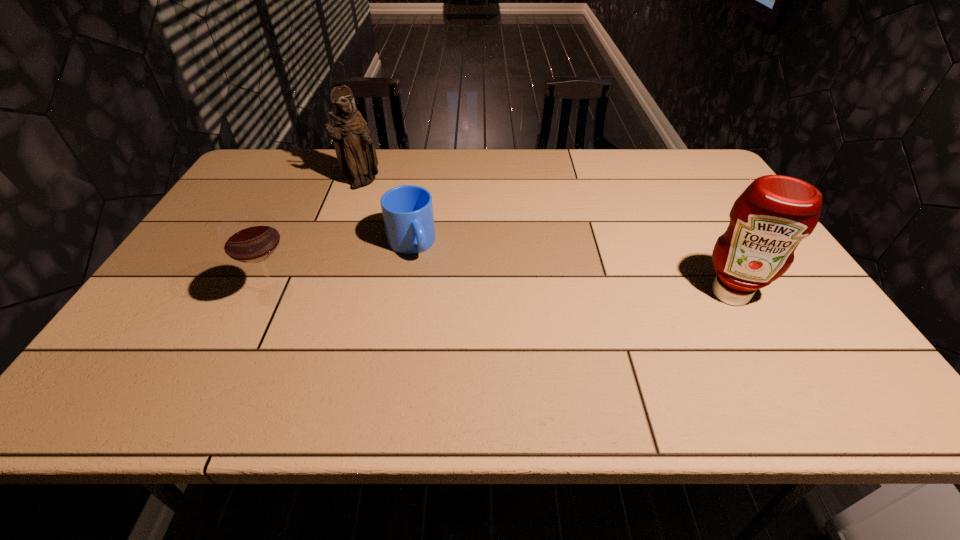
Where is `free location that satisfies the following two spatial constraints: 1. on the front side of the rightmost object; 2. on the left side of the third tallest object`? The image size is (960, 540). free location that satisfies the following two spatial constraints: 1. on the front side of the rightmost object; 2. on the left side of the third tallest object is located at coordinates (276, 294).